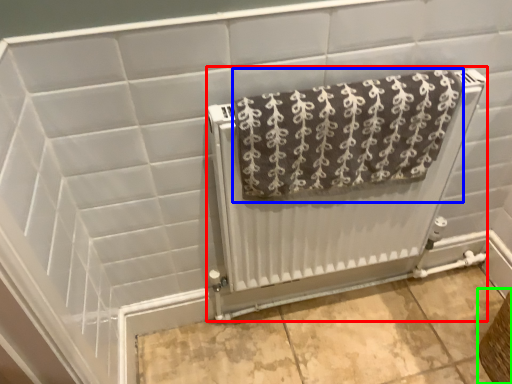
Question: Which is farther away from radiator (highlighted by a red box)? towel (highlighted by a blue box) or basket (highlighted by a green box)?

Choices:
 (A) towel
 (B) basket

Answer: (B)